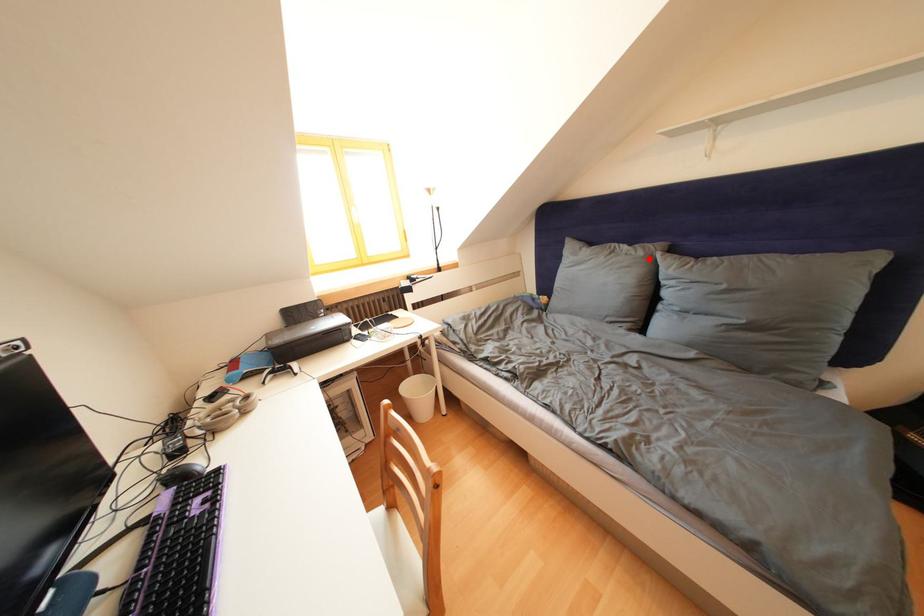
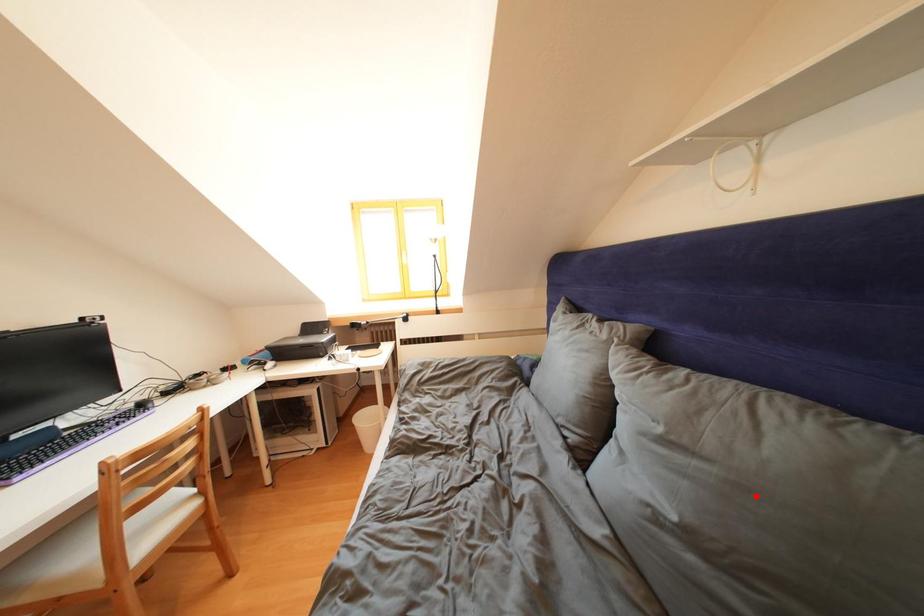
I am providing you with two images of the same scene from different viewpoints. A red point is marked on the first image and another point is marked on the second image. Does the point marked in image1 correspond to the same location as the one in image2?

No